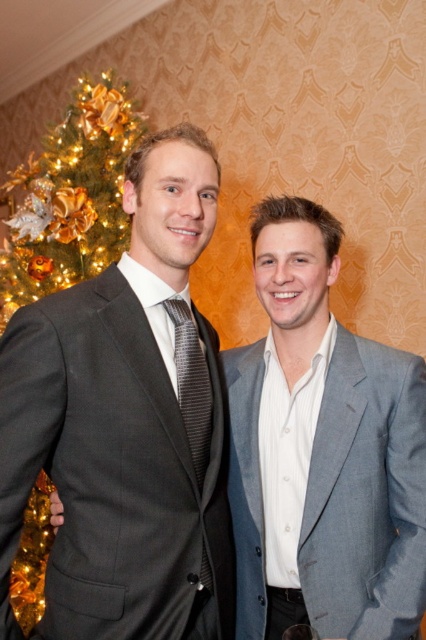
Who is higher up, matte gray suit at left or shiny gold ornaments at left?

Positioned higher is shiny gold ornaments at left.

Between point (164, 387) and point (111, 211), which one is positioned in front?

Point (164, 387)

Which is in front, point (25, 449) or point (65, 250)?

Point (25, 449)

Locate an element on the screen. This screenshot has width=426, height=640. matte gray suit at left is located at coordinates (109, 468).

Find the location of a particular element. This screenshot has height=640, width=426. gray fabric suit at center is located at coordinates (322, 451).

Who is positioned more to the left, gray fabric suit at center or shiny gold ornaments at left?

shiny gold ornaments at left is more to the left.

Identify the location of gray fabric suit at center. The image size is (426, 640). (322, 451).

Based on the photo, is shiny gold ornaments at left to the left of black striped tie at center from the viewer's perspective?

Indeed, shiny gold ornaments at left is positioned on the left side of black striped tie at center.

Between point (40, 564) and point (192, 333), which one is positioned behind?

Point (40, 564)

Who is more forward, (95, 163) or (186, 369)?

Point (186, 369) is in front.

Where is `shiny gold ornaments at left`? This screenshot has height=640, width=426. shiny gold ornaments at left is located at coordinates (71, 196).